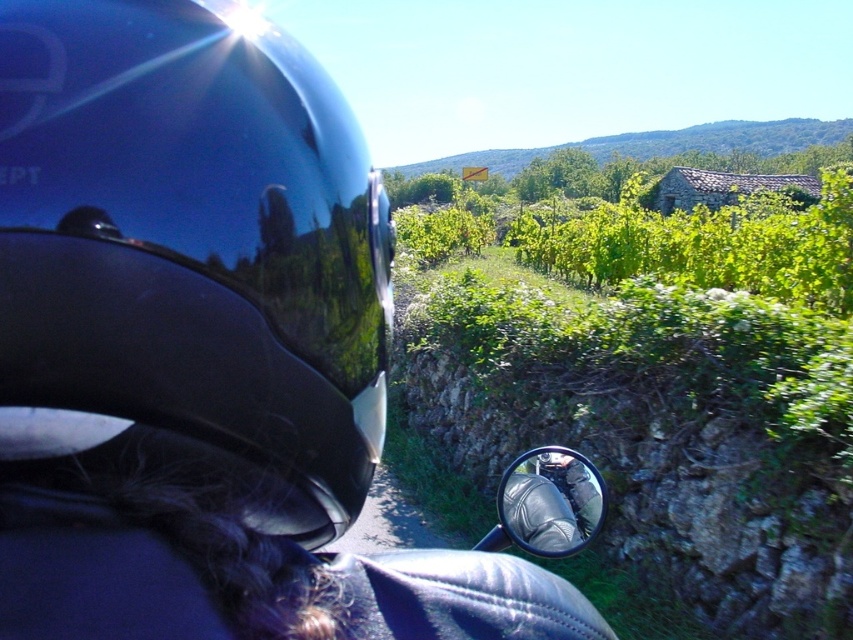
Question: Among these objects, which one is nearest to the camera?

Choices:
 (A) glossy metallic mirror at center
 (B) glossy black helmet at left

Answer: (B)

Question: In this image, where is glossy black helmet at left located relative to glossy metallic mirror at center?

Choices:
 (A) below
 (B) above

Answer: (B)

Question: Can you confirm if glossy black helmet at left is bigger than glossy metallic mirror at center?

Choices:
 (A) no
 (B) yes

Answer: (B)

Question: Is glossy black helmet at left thinner than glossy metallic mirror at center?

Choices:
 (A) no
 (B) yes

Answer: (B)